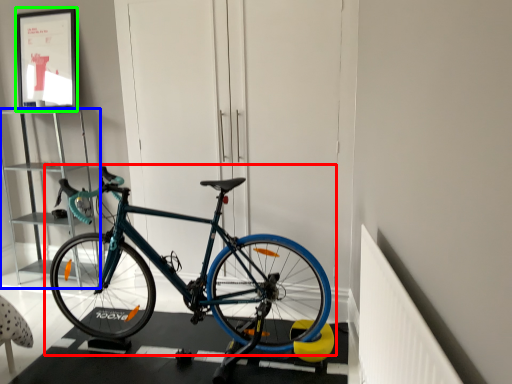
Question: Estimate the real-world distances between objects in this image. Which object is farther from bicycle (highlighted by a red box), cabinet (highlighted by a blue box) or picture frame (highlighted by a green box)?

Choices:
 (A) cabinet
 (B) picture frame

Answer: (B)